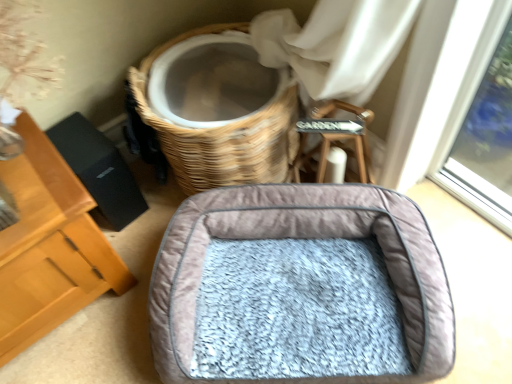
Question: Considering the relative sizes of gray plush dog bed at center and woven wood basket at upper center in the image provided, is gray plush dog bed at center smaller than woven wood basket at upper center?

Choices:
 (A) yes
 (B) no

Answer: (A)

Question: Does gray plush dog bed at center have a greater width compared to woven wood basket at upper center?

Choices:
 (A) no
 (B) yes

Answer: (B)

Question: Are gray plush dog bed at center and woven wood basket at upper center making contact?

Choices:
 (A) no
 (B) yes

Answer: (A)

Question: From a real-world perspective, is gray plush dog bed at center physically above woven wood basket at upper center?

Choices:
 (A) no
 (B) yes

Answer: (A)

Question: Considering the relative sizes of gray plush dog bed at center and woven wood basket at upper center in the image provided, is gray plush dog bed at center thinner than woven wood basket at upper center?

Choices:
 (A) yes
 (B) no

Answer: (B)

Question: Can you confirm if gray plush dog bed at center is bigger than woven wood basket at upper center?

Choices:
 (A) yes
 (B) no

Answer: (B)

Question: From a real-world perspective, is woven wood basket at upper center positioned over gray plush dog bed at center based on gravity?

Choices:
 (A) no
 (B) yes

Answer: (B)

Question: Does woven wood basket at upper center have a lesser width compared to gray plush dog bed at center?

Choices:
 (A) yes
 (B) no

Answer: (A)

Question: Considering the relative sizes of woven wood basket at upper center and gray plush dog bed at center in the image provided, is woven wood basket at upper center bigger than gray plush dog bed at center?

Choices:
 (A) yes
 (B) no

Answer: (A)

Question: Is woven wood basket at upper center at the left side of gray plush dog bed at center?

Choices:
 (A) yes
 (B) no

Answer: (A)

Question: Is woven wood basket at upper center further to camera compared to gray plush dog bed at center?

Choices:
 (A) no
 (B) yes

Answer: (B)

Question: Could you tell me if woven wood basket at upper center is turned towards gray plush dog bed at center?

Choices:
 (A) yes
 (B) no

Answer: (A)

Question: Considering the positions of woven wood basket at upper center and gray plush dog bed at center in the image, is woven wood basket at upper center taller or shorter than gray plush dog bed at center?

Choices:
 (A) tall
 (B) short

Answer: (A)